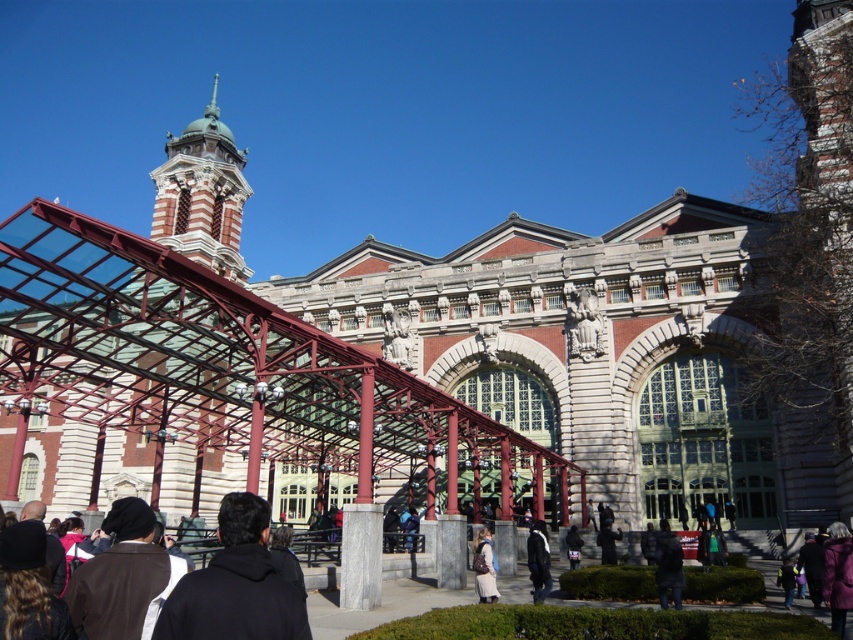
Question: In this image, where is black hoodie at center located relative to dark blue leather jacket at center?

Choices:
 (A) right
 (B) left

Answer: (B)

Question: Among these points, which one is nearest to the camera?

Choices:
 (A) (672, 586)
 (B) (606, 522)
 (C) (305, 628)
 (D) (476, 547)

Answer: (C)

Question: Which point is farther to the camera?

Choices:
 (A) dark gray jacket at lower right
 (B) dark gray fabric jacket at lower center

Answer: (B)

Question: Can you confirm if dark gray jacket at lower right is positioned to the left of dark gray fabric jacket at lower center?

Choices:
 (A) no
 (B) yes

Answer: (A)

Question: Estimate the real-world distances between objects in this image. Which object is farther from the dark gray fabric jacket at lower center?

Choices:
 (A) dark gray jacket at lower right
 (B) brown leather backpack at center
 (C) dark gray jacket at center

Answer: (B)

Question: Is brown leather backpack at center positioned at the back of dark gray jacket at center?

Choices:
 (A) yes
 (B) no

Answer: (B)